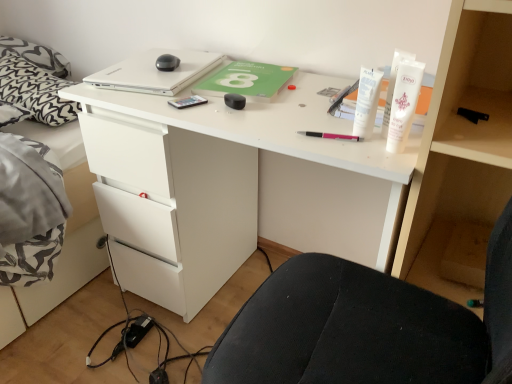
Where is `vacant area in front of white matte tube at upper right, the 1th toiletry in the left-to-right sequence`? The image size is (512, 384). vacant area in front of white matte tube at upper right, the 1th toiletry in the left-to-right sequence is located at coordinates (369, 155).